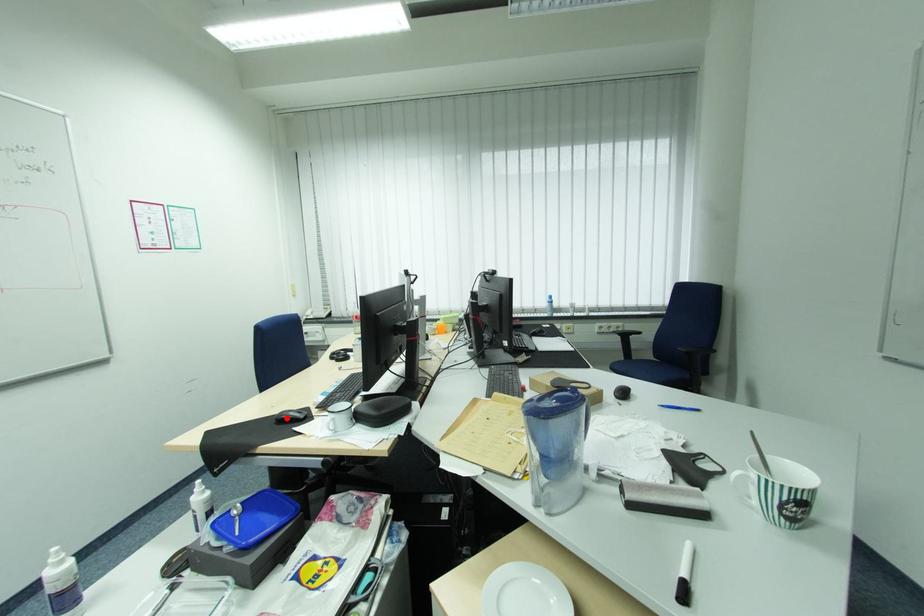
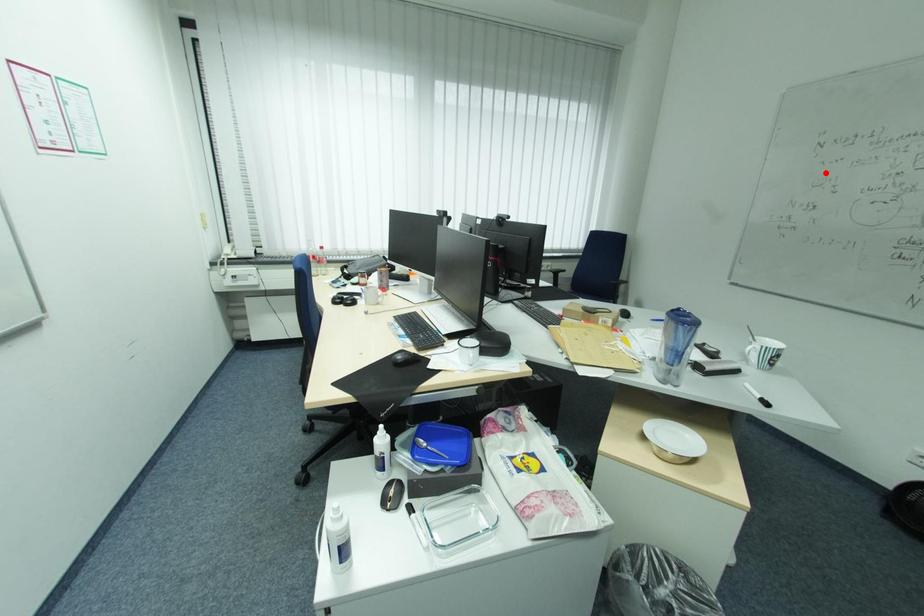
I am providing you with two images of the same scene from different viewpoints. A red point is marked on the first image and another point is marked on the second image. Are the points marked in image1 and image2 representing the same 3D position?

No